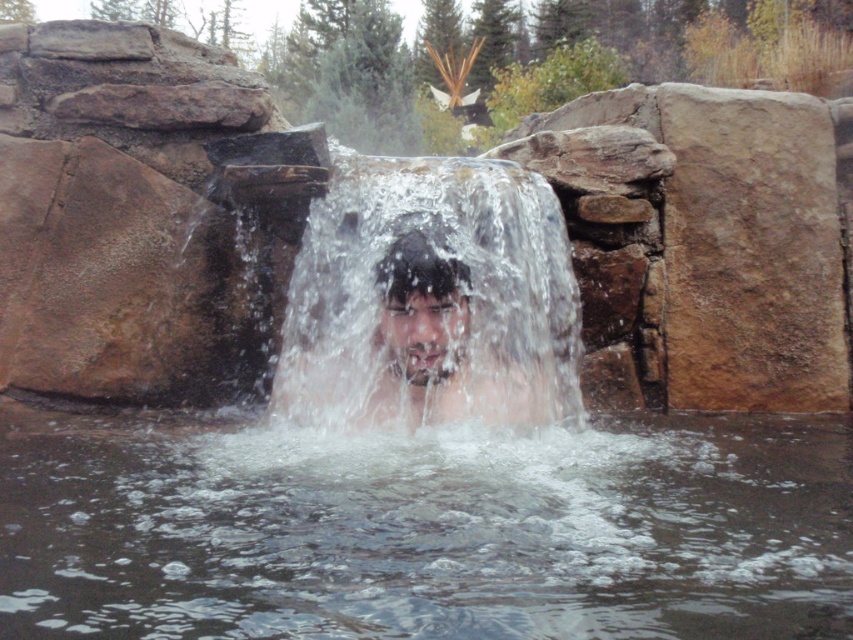
Between point (483, 310) and point (425, 420), which one is positioned behind?

The point (483, 310) is more distant.

Is point (320, 308) in front of point (384, 403)?

No, it is not.

You are a GUI agent. You are given a task and a screenshot of the screen. Output one action in this format:
    pyautogui.click(x=<x>, y=<y>)
    Task: Click on the clear water at center
    The width and height of the screenshot is (853, 640).
    Given the screenshot: What is the action you would take?
    pyautogui.click(x=431, y=300)

Is clear liquid water at center positioned before clear water at center?

That is True.

Does point (80, 492) lie behind point (492, 346)?

No, it is not.

At what (x,y) coordinates should I click in order to perform the action: click on clear liquid water at center. Please return your answer as a coordinate pair (x, y). Image resolution: width=853 pixels, height=640 pixels. Looking at the image, I should click on click(424, 531).

Locate an element on the screen. This screenshot has height=640, width=853. clear liquid water at center is located at coordinates (424, 531).

Does point (120, 534) lie behind point (408, 365)?

No.

Which is above, clear liquid water at center or smooth skin face at center?

Positioned higher is smooth skin face at center.

Which is behind, point (827, 458) or point (412, 289)?

Point (827, 458)

The width and height of the screenshot is (853, 640). Find the location of `clear liquid water at center`. clear liquid water at center is located at coordinates (424, 531).